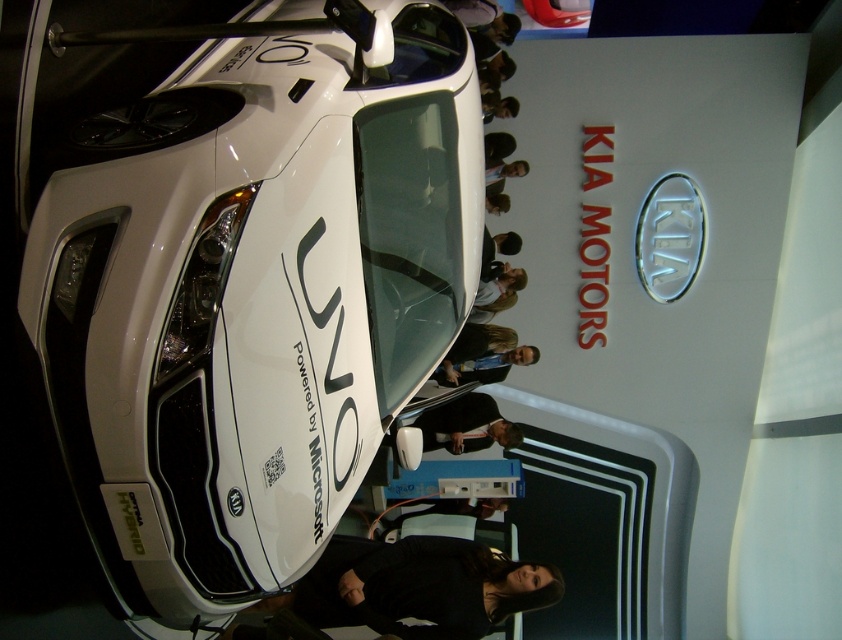
You are standing in front of the Kia UVO vehicle at the exhibition. There are two points marked on the car, one at coordinate point (445,448) and another at point (509,109). Which point is closer to you?

Point (445,448) is closer to the viewer than point (509,109).

You are standing in front of the Kia UVO vehicle at the auto show. There are two points marked on the car, one at coordinates point (494, 289) and another at point (518, 102). If you want to touch the point that is closer to you, which coordinate should you aim for?

You should aim for point (494, 289) because it is closer to the camera than point (518, 102).